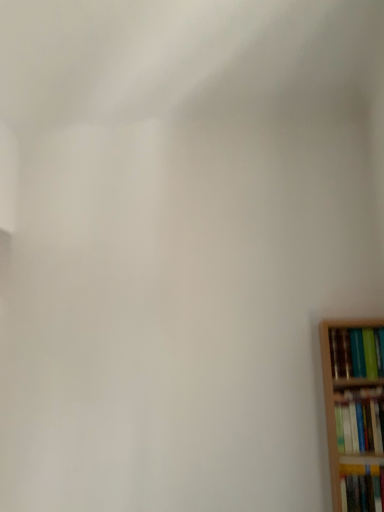
Question: From a real-world perspective, is hardcover book at lower right, the third book in the top-to-bottom sequence, physically above hardcover book at right, the first book when ordered from top to bottom?

Choices:
 (A) yes
 (B) no

Answer: (B)

Question: Is hardcover book at right, the first book when ordered from top to bottom, a part of hardcover book at lower right, the third book in the top-to-bottom sequence?

Choices:
 (A) no
 (B) yes

Answer: (A)

Question: Is hardcover book at lower right, the third book in the top-to-bottom sequence, smaller than hardcover book at right, the first book when ordered from top to bottom?

Choices:
 (A) no
 (B) yes

Answer: (B)

Question: Is hardcover book at lower right, the third book in the top-to-bottom sequence, at the left side of hardcover book at right, which is the 3th book in bottom-to-top order?

Choices:
 (A) yes
 (B) no

Answer: (B)

Question: Can you confirm if hardcover book at lower right, the third book in the top-to-bottom sequence, is thinner than hardcover book at right, the first book when ordered from top to bottom?

Choices:
 (A) no
 (B) yes

Answer: (B)

Question: From the image's perspective, is hardcover book at right, the first book when ordered from top to bottom, positioned above or below hardcover book at right, which is the second book from bottom to top?

Choices:
 (A) above
 (B) below

Answer: (A)

Question: Is hardcover book at right, which is the 3th book in bottom-to-top order, in front of or behind hardcover book at right, the second book in the top-to-bottom sequence, in the image?

Choices:
 (A) front
 (B) behind

Answer: (B)

Question: Considering the positions of hardcover book at right, which is the 3th book in bottom-to-top order, and hardcover book at right, which is the second book from bottom to top, in the image, is hardcover book at right, which is the 3th book in bottom-to-top order, taller or shorter than hardcover book at right, which is the second book from bottom to top,?

Choices:
 (A) short
 (B) tall

Answer: (A)

Question: Considering the positions of point (374, 349) and point (365, 422), is point (374, 349) closer or farther from the camera than point (365, 422)?

Choices:
 (A) closer
 (B) farther

Answer: (B)

Question: Would you say hardcover book at right, which is the second book from bottom to top, is inside or outside hardcover book at right, the first book when ordered from top to bottom?

Choices:
 (A) outside
 (B) inside

Answer: (A)

Question: Based on their sizes in the image, would you say hardcover book at right, which is the second book from bottom to top, is bigger or smaller than hardcover book at right, which is the 3th book in bottom-to-top order?

Choices:
 (A) small
 (B) big

Answer: (A)

Question: In terms of height, does hardcover book at right, which is the second book from bottom to top, look taller or shorter compared to hardcover book at right, which is the 3th book in bottom-to-top order?

Choices:
 (A) short
 (B) tall

Answer: (B)

Question: In terms of width, does hardcover book at right, which is the second book from bottom to top, look wider or thinner when compared to hardcover book at right, the first book when ordered from top to bottom?

Choices:
 (A) wide
 (B) thin

Answer: (B)

Question: Considering their positions, is hardcover book at lower right, positioned as the first book in bottom-to-top order, located in front of or behind hardcover book at right, the second book in the top-to-bottom sequence?

Choices:
 (A) front
 (B) behind

Answer: (A)

Question: From the image's perspective, is hardcover book at lower right, the third book in the top-to-bottom sequence, located above or below hardcover book at right, the second book in the top-to-bottom sequence?

Choices:
 (A) below
 (B) above

Answer: (A)